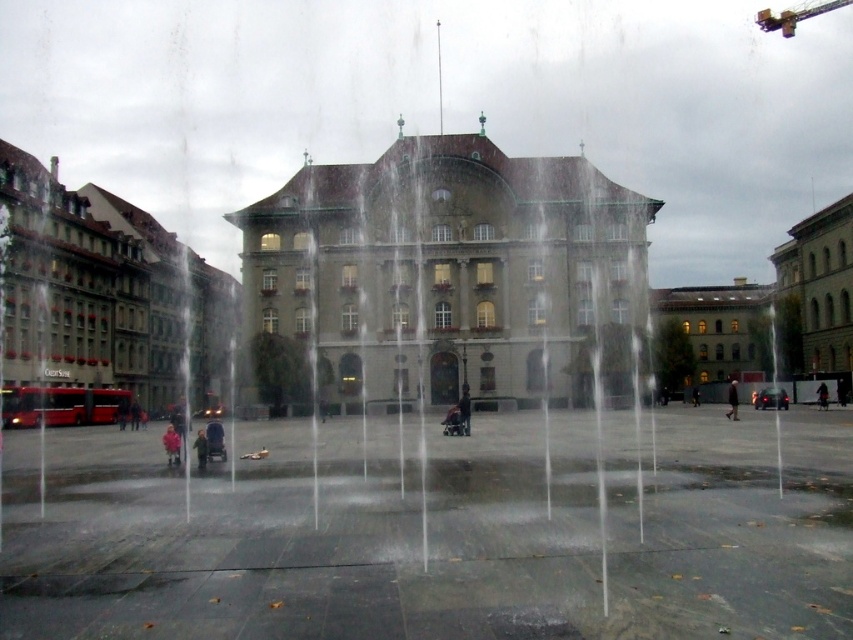
From the picture: Who is lower down, dark gray fabric jacket at center or dark blue jacket at center?

dark blue jacket at center is lower down.

Does dark gray fabric jacket at center appear on the left side of dark blue jacket at center?

Indeed, dark gray fabric jacket at center is positioned on the left side of dark blue jacket at center.

This screenshot has height=640, width=853. What do you see at coordinates (732, 401) in the screenshot?
I see `dark gray fabric jacket at center` at bounding box center [732, 401].

This screenshot has width=853, height=640. In order to click on dark gray fabric jacket at center in this screenshot , I will do `click(732, 401)`.

Between point (170, 445) and point (734, 401), which one is positioned in front?

Positioned in front is point (170, 445).

Who is positioned more to the right, pink fabric coat at center or dark gray fabric jacket at center?

Answer: dark gray fabric jacket at center is more to the right.

Between point (175, 460) and point (729, 413), which one is positioned behind?

The point (729, 413) is more distant.

At what (x,y) coordinates should I click in order to perform the action: click on pink fabric coat at center. Please return your answer as a coordinate pair (x, y). Looking at the image, I should click on (171, 444).

Is dark blue jeans at center behind light pink fabric coat at center?

Yes, it is.

Is point (466, 413) in front of point (193, 444)?

No, (466, 413) is behind (193, 444).

Between point (467, 387) and point (202, 452), which one is positioned behind?

The point (467, 387) is more distant.

Locate an element on the screen. This screenshot has width=853, height=640. dark blue jeans at center is located at coordinates (463, 410).